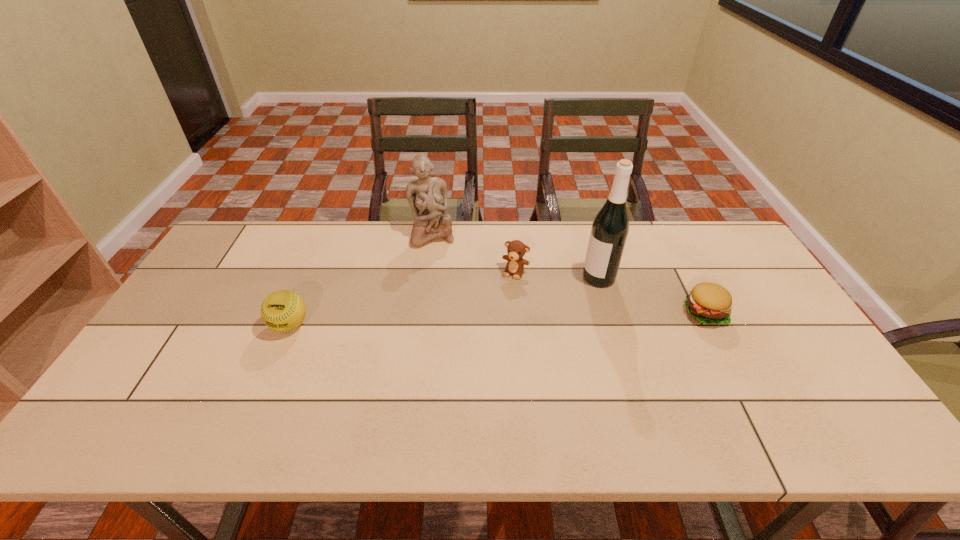
I want to click on vacant space located on the face of the third object from left to right, so click(483, 332).

You are a GUI agent. You are given a task and a screenshot of the screen. Output one action in this format:
    pyautogui.click(x=<x>, y=<y>)
    Task: Click on the vacant space located on the face of the third object from left to right
    This screenshot has height=540, width=960.
    Given the screenshot: What is the action you would take?
    pyautogui.click(x=481, y=334)

You are a GUI agent. You are given a task and a screenshot of the screen. Output one action in this format:
    pyautogui.click(x=<x>, y=<y>)
    Task: Click on the vacant area located on the face of the third object from left to right
    Image resolution: width=960 pixels, height=540 pixels.
    Given the screenshot: What is the action you would take?
    pyautogui.click(x=472, y=350)

Locate an element on the screen. vacant area situated 0.280m on the label of the wine bottle is located at coordinates (516, 324).

At what (x,y) coordinates should I click in order to perform the action: click on free space located on the label of the wine bottle. Please return your answer as a coordinate pair (x, y). Looking at the image, I should click on (573, 292).

The width and height of the screenshot is (960, 540). Find the location of `free location located on the label of the wine bottle`. free location located on the label of the wine bottle is located at coordinates (553, 303).

I want to click on free space located 0.270m on the front-facing side of the farthest object, so click(x=450, y=305).

Locate an element on the screen. This screenshot has height=540, width=960. vacant position located 0.100m on the front-facing side of the farthest object is located at coordinates (441, 268).

I want to click on free space located on the front-facing side of the farthest object, so coord(447,296).

Find the location of a particular element. Image resolution: width=960 pixels, height=540 pixels. teddy bear situated at the far edge is located at coordinates (516, 249).